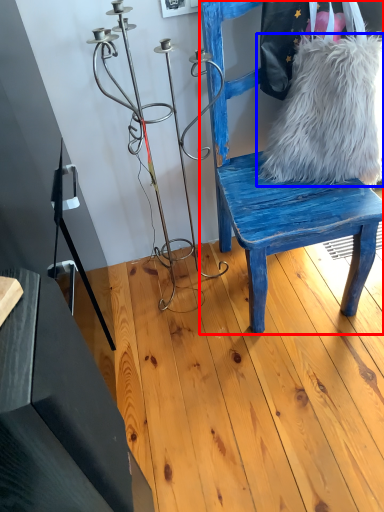
Question: Among these objects, which one is nearest to the camera, chair (highlighted by a red box) or fur (highlighted by a blue box)?

Choices:
 (A) chair
 (B) fur

Answer: (A)